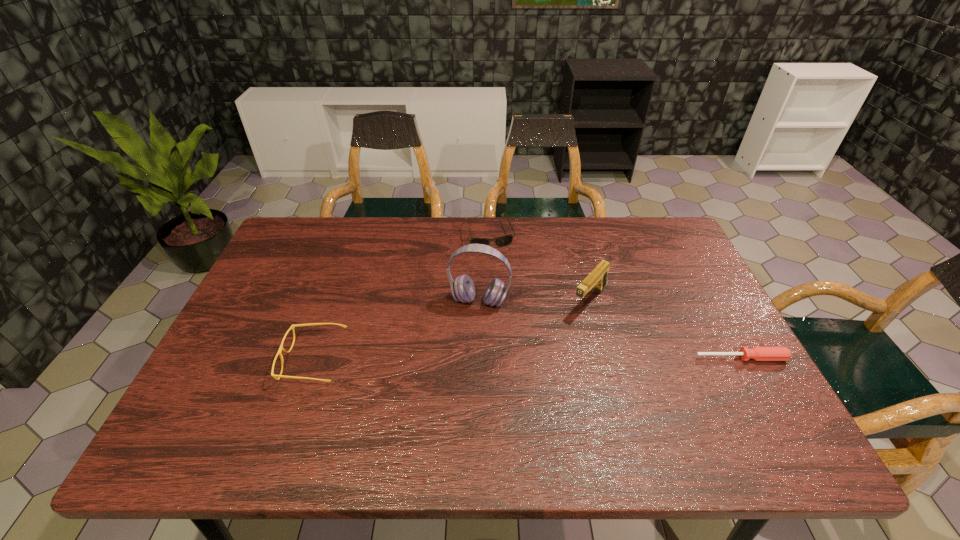
In order to click on free space between the sunglasses and the tallest object in this screenshot , I will do `click(484, 267)`.

Identify the location of unoccupied area between the headset and the spectacles. Image resolution: width=960 pixels, height=540 pixels. (396, 331).

At what (x,y) coordinates should I click in order to perform the action: click on free space between the tallest object and the screwdriver. Please return your answer as a coordinate pair (x, y). Looking at the image, I should click on (611, 329).

You are a GUI agent. You are given a task and a screenshot of the screen. Output one action in this format:
    pyautogui.click(x=<x>, y=<y>)
    Task: Click on the free space between the tallest object and the pistol
    
    Given the screenshot: What is the action you would take?
    pyautogui.click(x=535, y=301)

This screenshot has width=960, height=540. Find the location of `free point between the second object from right to left and the headset`. free point between the second object from right to left and the headset is located at coordinates (535, 301).

What are the coordinates of `vacant point located between the sunglasses and the shortest object` in the screenshot? It's located at (615, 296).

At what (x,y) coordinates should I click in order to perform the action: click on blank region between the leftmost object and the pistol. Please return your answer as a coordinate pair (x, y). This screenshot has height=540, width=960. Looking at the image, I should click on (451, 330).

Identify the location of blank region between the screwdriver and the sunglasses. The image size is (960, 540). (615, 296).

In order to click on vacant space that is in between the rightmost object and the farthest object in this screenshot , I will do `click(615, 296)`.

Identify which object is the third nearest to the rightmost object. Please provide its 2D coordinates. Your answer should be formatted as a tuple, i.e. [(x, y)], where the tuple contains the x and y coordinates of a point satisfying the conditions above.

[(505, 240)]